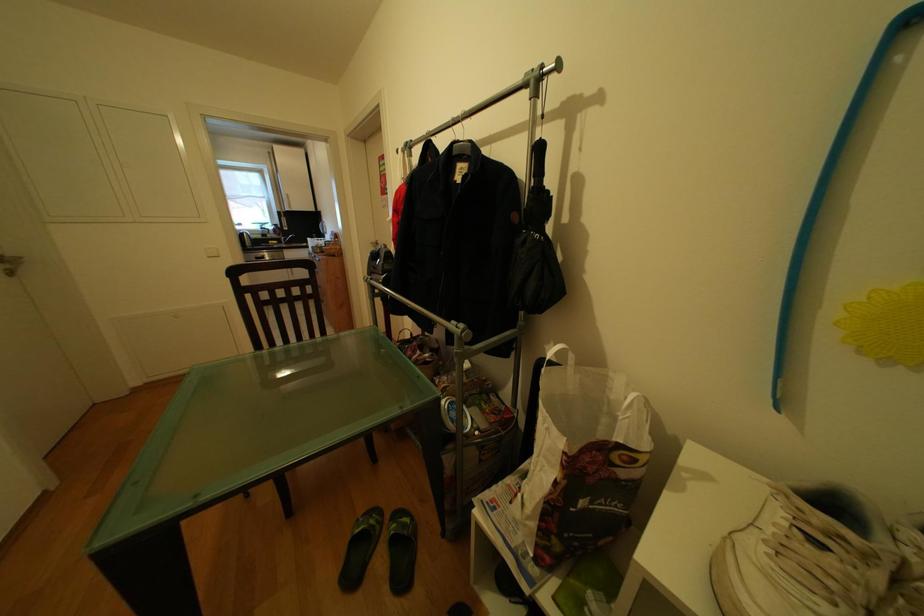
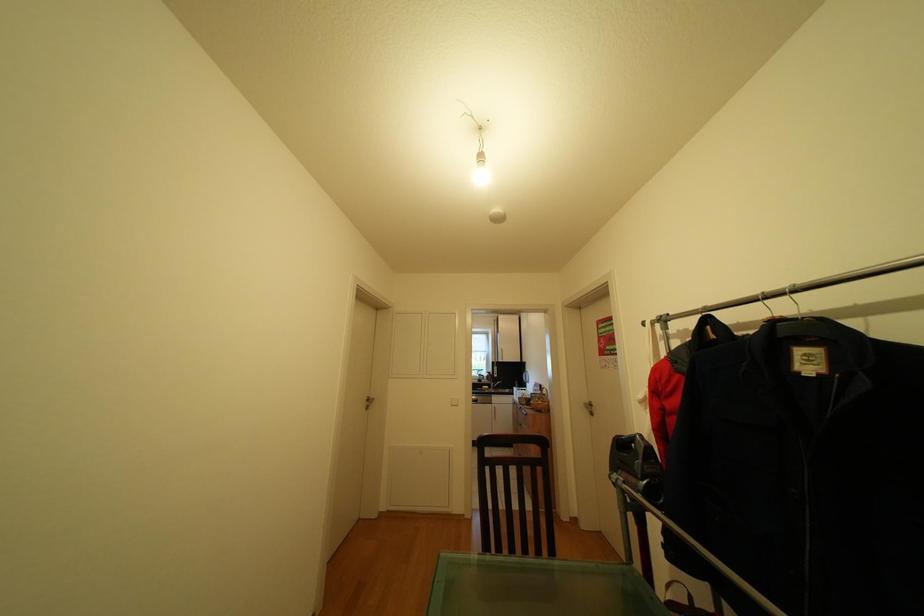
How did the camera likely rotate?

The camera's rotation is toward left-up.